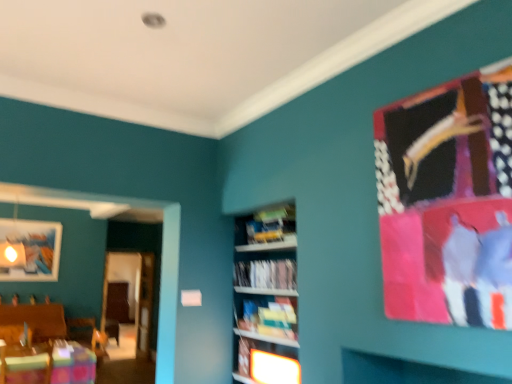
Question: Does yellow paperback book at center, placed as the 1th book when sorted from bottom to top, lie in front of matte wooden picture frame at upper left?

Choices:
 (A) yes
 (B) no

Answer: (A)

Question: Can you confirm if yellow paperback book at center, placed as the 1th book when sorted from bottom to top, is shorter than matte wooden picture frame at upper left?

Choices:
 (A) yes
 (B) no

Answer: (A)

Question: Is matte wooden picture frame at upper left a part of yellow paperback book at center, placed as the 1th book when sorted from bottom to top?

Choices:
 (A) no
 (B) yes

Answer: (A)

Question: Is yellow paperback book at center, which appears as the second book when viewed from the top, further to the viewer compared to matte wooden picture frame at upper left?

Choices:
 (A) yes
 (B) no

Answer: (B)

Question: From the image's perspective, is yellow paperback book at center, which appears as the second book when viewed from the top, located above matte wooden picture frame at upper left?

Choices:
 (A) yes
 (B) no

Answer: (A)

Question: Would you say wooden table at lower left is to the left or to the right of white paper at center, the 1th book positioned from the top, in the picture?

Choices:
 (A) right
 (B) left

Answer: (B)

Question: Considering their positions, is wooden table at lower left located in front of or behind white paper at center, the 1th book positioned from the top?

Choices:
 (A) front
 (B) behind

Answer: (B)

Question: Is point (53, 374) closer or farther from the camera than point (285, 278)?

Choices:
 (A) farther
 (B) closer

Answer: (A)

Question: From a real-world perspective, is wooden table at lower left physically located above or below white paper at center, the second book positioned from the bottom?

Choices:
 (A) above
 (B) below

Answer: (B)

Question: Considering the positions of matte white shelf at center and wooden table at lower left in the image, is matte white shelf at center wider or thinner than wooden table at lower left?

Choices:
 (A) thin
 (B) wide

Answer: (A)

Question: In the image, is matte white shelf at center positioned in front of or behind wooden table at lower left?

Choices:
 (A) behind
 (B) front

Answer: (B)

Question: From the image's perspective, is matte white shelf at center above or below wooden table at lower left?

Choices:
 (A) above
 (B) below

Answer: (A)

Question: Considering the positions of point (281, 365) and point (66, 377), is point (281, 365) closer or farther from the camera than point (66, 377)?

Choices:
 (A) closer
 (B) farther

Answer: (A)

Question: Is point (279, 283) positioned closer to the camera than point (284, 357)?

Choices:
 (A) farther
 (B) closer

Answer: (B)

Question: Relative to matte white shelf at center, is white paper at center, the 1th book positioned from the top, in front or behind?

Choices:
 (A) behind
 (B) front

Answer: (A)